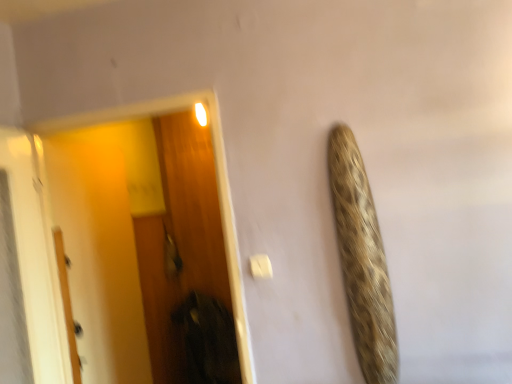
Question: From a real-world perspective, is white matte door at left physically located above or below wooden screen door at left?

Choices:
 (A) below
 (B) above

Answer: (A)

Question: Looking at their shapes, would you say white matte door at left is wider or thinner than wooden screen door at left?

Choices:
 (A) wide
 (B) thin

Answer: (B)

Question: From the image's perspective, relative to wooden screen door at left, is white matte door at left above or below?

Choices:
 (A) below
 (B) above

Answer: (A)

Question: Based on their sizes in the image, would you say wooden screen door at left is bigger or smaller than white matte door at left?

Choices:
 (A) big
 (B) small

Answer: (A)

Question: Considering the positions of point (224, 175) and point (74, 342), is point (224, 175) closer or farther from the camera than point (74, 342)?

Choices:
 (A) closer
 (B) farther

Answer: (A)

Question: Considering the positions of wooden screen door at left and white matte door at left in the image, is wooden screen door at left wider or thinner than white matte door at left?

Choices:
 (A) thin
 (B) wide

Answer: (B)

Question: From a real-world perspective, is wooden screen door at left physically located above or below white matte door at left?

Choices:
 (A) above
 (B) below

Answer: (A)